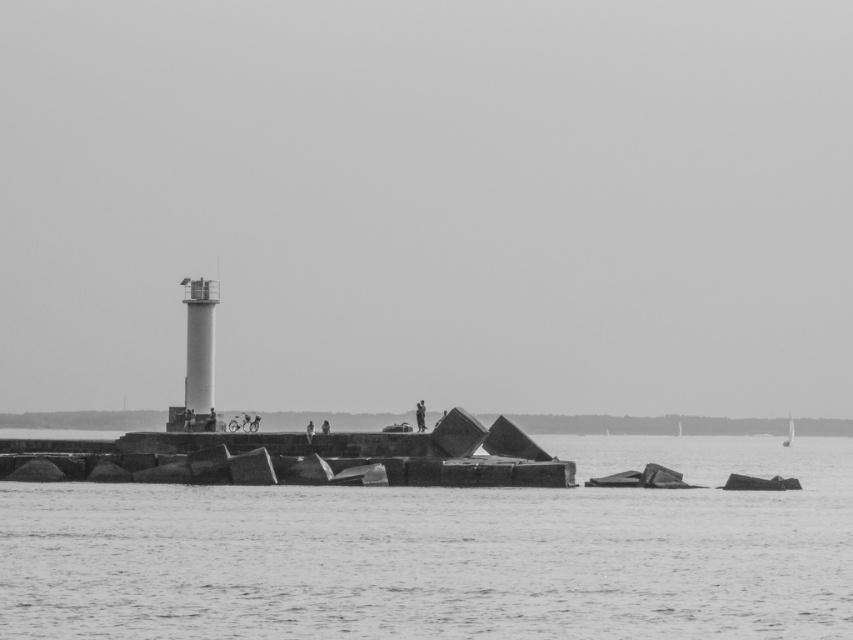
You are a photographer trying to capture the white matte sailboat at center in your shot. However, the smooth concrete water at center is blocking your view. Can you determine which object is closer to you based on their positions?

The smooth concrete water at center is positioned over the white matte sailboat at center, meaning the smooth concrete water at center is closer to you and blocking the view of the sailboat.

You are a photographer standing on the breakwater and want to capture both the smooth concrete water at center and the white matte sailboat at center in the same frame. Which object should you position closer to the foreground of your photo?

You should position the smooth concrete water at center closer to the foreground because it is in front of the white matte sailboat at center, making it naturally closer to the camera.